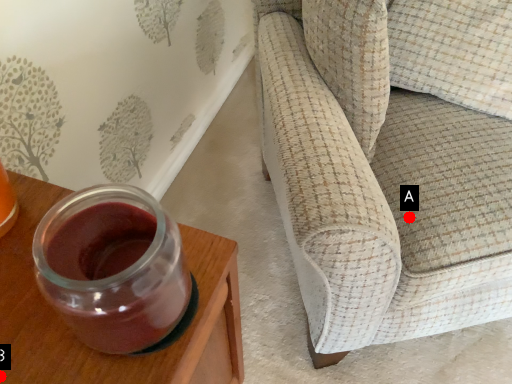
Question: Two points are circled on the image, labeled by A and B beside each circle. Which point is farther to the camera?

Choices:
 (A) A is further
 (B) B is further

Answer: (A)